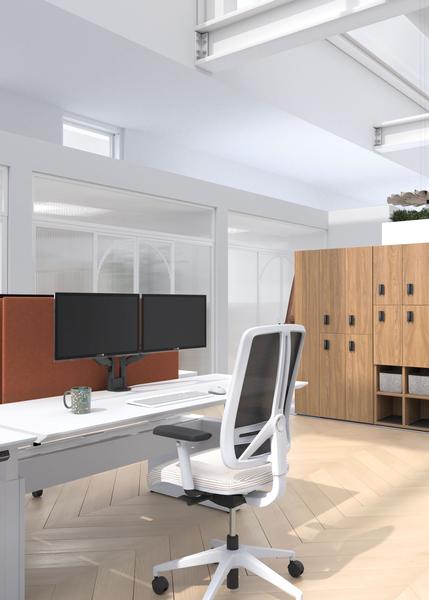
Find the location of a particular element. desk is located at coordinates (46, 418).